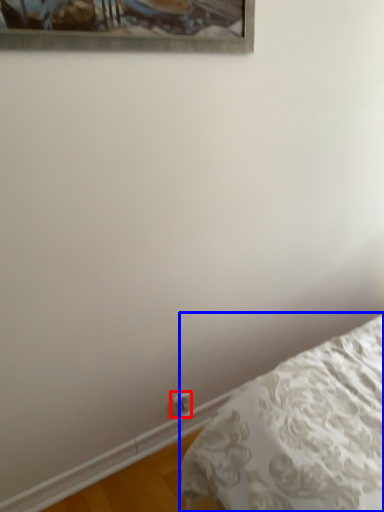
Question: Among these objects, which one is nearest to the camera, electric outlet (highlighted by a red box) or bed (highlighted by a blue box)?

Choices:
 (A) electric outlet
 (B) bed

Answer: (B)